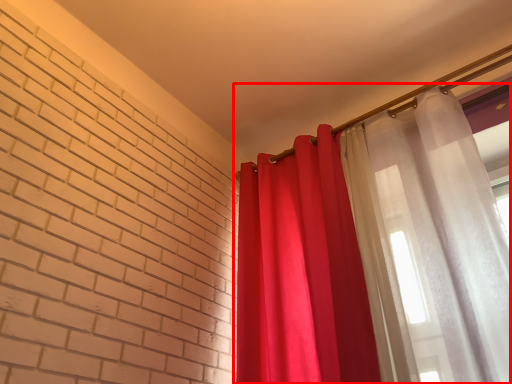
Question: From the image's perspective, where is curtain (annotated by the red box) located in relation to curtain in the image?

Choices:
 (A) above
 (B) below

Answer: (A)